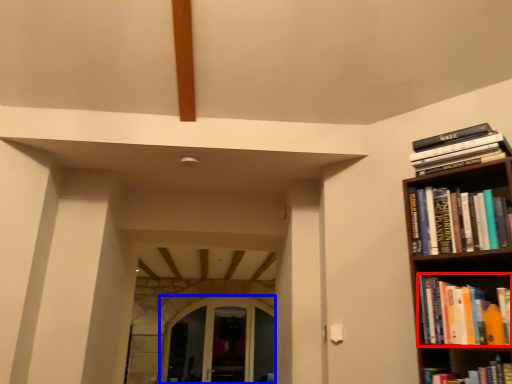
Question: Which of the following is the closest to the observer, book (highlighted by a red box) or glass door (highlighted by a blue box)?

Choices:
 (A) book
 (B) glass door

Answer: (A)